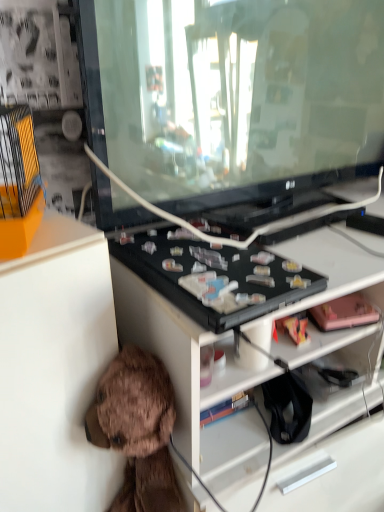
In order to face pink matte toy at right, which is the first toy in top-to-bottom order, should I rotate leftwards or rightwards?

Rotate your view right by about 19.584°.

Where is `pink matte toy at right, which is the first toy in top-to-bottom order`? The image size is (384, 512). pink matte toy at right, which is the first toy in top-to-bottom order is located at coordinates (344, 313).

Where is `pink matte toy at right, placed as the 2th toy when sorted from left to right`? This screenshot has width=384, height=512. pink matte toy at right, placed as the 2th toy when sorted from left to right is located at coordinates (344, 313).

How far apart are brown plush toy at lower left, the 2th toy positioned from the right, and transparent glass tv at center?

A: brown plush toy at lower left, the 2th toy positioned from the right, and transparent glass tv at center are 21.65 inches apart from each other.

Considering the relative sizes of brown plush toy at lower left, marked as the first toy in a bottom-to-top arrangement, and transparent glass tv at center in the image provided, is brown plush toy at lower left, marked as the first toy in a bottom-to-top arrangement, taller than transparent glass tv at center?

Yes, brown plush toy at lower left, marked as the first toy in a bottom-to-top arrangement, is taller than transparent glass tv at center.

In the scene shown: Does brown plush toy at lower left, the 2th toy positioned from the right, appear on the left side of transparent glass tv at center?

Yes.

Is brown plush toy at lower left, which is the 1th toy in left-to-right order, next to transparent glass tv at center?

No, brown plush toy at lower left, which is the 1th toy in left-to-right order, is not in contact with transparent glass tv at center.

Is pink matte toy at right, which is the first toy in top-to-bottom order, wider or thinner than brown plush toy at lower left, the 2th toy positioned from the right?

Clearly, pink matte toy at right, which is the first toy in top-to-bottom order, has less width compared to brown plush toy at lower left, the 2th toy positioned from the right.

Which of these two, pink matte toy at right, which is the second toy in bottom-to-top order, or brown plush toy at lower left, the 2th toy positioned from the right, stands shorter?

Standing shorter between the two is pink matte toy at right, which is the second toy in bottom-to-top order.

Visually, is pink matte toy at right, which is the second toy in bottom-to-top order, positioned to the left or to the right of brown plush toy at lower left, which is the 1th toy in left-to-right order?

pink matte toy at right, which is the second toy in bottom-to-top order, is to the right of brown plush toy at lower left, which is the 1th toy in left-to-right order.

I want to click on toy above the brown plush toy at lower left, marked as the first toy in a bottom-to-top arrangement (from the image's perspective), so click(x=344, y=313).

Between transparent glass tv at center and pink matte toy at right, the first toy when ordered from right to left, which one is positioned behind?

pink matte toy at right, the first toy when ordered from right to left, is further away from the camera.

In terms of height, does transparent glass tv at center look taller or shorter compared to pink matte toy at right, which is the first toy in top-to-bottom order?

In the image, transparent glass tv at center appears to be taller than pink matte toy at right, which is the first toy in top-to-bottom order.

Locate an element on the screen. the 1st toy below the transparent glass tv at center (from the image's perspective) is located at coordinates (344, 313).

Is transparent glass tv at center bigger than pink matte toy at right, placed as the 2th toy when sorted from left to right?

Yes.

Is brown plush toy at lower left, positioned as the 2th toy in top-to-bottom order, aimed at white matte cabinet at lower left?

No, brown plush toy at lower left, positioned as the 2th toy in top-to-bottom order, is not turned towards white matte cabinet at lower left.

Can you confirm if brown plush toy at lower left, the 2th toy positioned from the right, is wider than white matte cabinet at lower left?

No, brown plush toy at lower left, the 2th toy positioned from the right, is not wider than white matte cabinet at lower left.

Based on the photo, is brown plush toy at lower left, which is the 1th toy in left-to-right order, positioned far away from white matte cabinet at lower left?

They are positioned close to each other.

From the image's perspective, would you say brown plush toy at lower left, marked as the first toy in a bottom-to-top arrangement, is positioned over white matte cabinet at lower left?

Actually, brown plush toy at lower left, marked as the first toy in a bottom-to-top arrangement, appears below white matte cabinet at lower left in the image.

Is point (235, 194) less distant than point (121, 463)?

No, (235, 194) is behind (121, 463).

Is transparent glass tv at center not close to white matte cabinet at lower left?

No, transparent glass tv at center is not far from white matte cabinet at lower left.

Is transparent glass tv at center bigger than white matte cabinet at lower left?

Correct, transparent glass tv at center is larger in size than white matte cabinet at lower left.

Which object is thinner, transparent glass tv at center or white matte cabinet at lower left?

With smaller width is transparent glass tv at center.

How much distance is there between white matte cabinet at lower left and transparent glass tv at center?

white matte cabinet at lower left is 17.20 inches from transparent glass tv at center.

Which point is more distant from viewer, (95, 328) or (383, 38)?

Point (383, 38)

How many degrees apart are the facing directions of white matte cabinet at lower left and transparent glass tv at center?

9.65 degrees.

Relative to transparent glass tv at center, is white matte cabinet at lower left in front or behind?

white matte cabinet at lower left is in front of transparent glass tv at center.

Considering the relative sizes of transparent glass tv at center and brown plush toy at lower left, the 2th toy positioned from the right, in the image provided, is transparent glass tv at center bigger than brown plush toy at lower left, the 2th toy positioned from the right,?

Yes.

Is transparent glass tv at center taller than brown plush toy at lower left, the 2th toy positioned from the right?

In fact, transparent glass tv at center may be shorter than brown plush toy at lower left, the 2th toy positioned from the right.

From a real-world perspective, is transparent glass tv at center physically above brown plush toy at lower left, marked as the first toy in a bottom-to-top arrangement?

Yes, from a real-world perspective, transparent glass tv at center is on top of brown plush toy at lower left, marked as the first toy in a bottom-to-top arrangement.

Can brown plush toy at lower left, the 2th toy positioned from the right, be found inside transparent glass tv at center?

No, brown plush toy at lower left, the 2th toy positioned from the right, is not a part of transparent glass tv at center.

Find the location of `the 1st toy behind the transparent glass tv at center, starting your count from the anchor`. the 1st toy behind the transparent glass tv at center, starting your count from the anchor is located at coordinates (137, 429).

Image resolution: width=384 pixels, height=512 pixels. I want to click on toy that is on the right side of brown plush toy at lower left, marked as the first toy in a bottom-to-top arrangement, so [x=344, y=313].

Estimate the real-world distances between objects in this image. Which object is further from transparent glass tv at center, pink matte toy at right, which is the first toy in top-to-bottom order, or white matte cabinet at lower left?

pink matte toy at right, which is the first toy in top-to-bottom order.

Estimate the real-world distances between objects in this image. Which object is closer to brown plush toy at lower left, positioned as the 2th toy in top-to-bottom order, white matte cabinet at lower left or transparent glass tv at center?

white matte cabinet at lower left lies closer to brown plush toy at lower left, positioned as the 2th toy in top-to-bottom order, than the other object.

When comparing their distances from brown plush toy at lower left, positioned as the 2th toy in top-to-bottom order, does pink matte toy at right, the first toy when ordered from right to left, or white matte cabinet at lower left seem further?

Among the two, pink matte toy at right, the first toy when ordered from right to left, is located further to brown plush toy at lower left, positioned as the 2th toy in top-to-bottom order.

Based on their spatial positions, is brown plush toy at lower left, the 2th toy positioned from the right, or pink matte toy at right, which is the first toy in top-to-bottom order, closer to white matte cabinet at lower left?

brown plush toy at lower left, the 2th toy positioned from the right, is positioned closer to the anchor white matte cabinet at lower left.

Based on their spatial positions, is transparent glass tv at center or white matte cabinet at lower left closer to brown plush toy at lower left, the 2th toy positioned from the right?

white matte cabinet at lower left lies closer to brown plush toy at lower left, the 2th toy positioned from the right, than the other object.

In the scene shown: Based on their spatial positions, is pink matte toy at right, which is the first toy in top-to-bottom order, or transparent glass tv at center closer to brown plush toy at lower left, the 2th toy positioned from the right?

pink matte toy at right, which is the first toy in top-to-bottom order.

Looking at the image, which one is located closer to pink matte toy at right, which is the second toy in bottom-to-top order, white matte cabinet at lower left or brown plush toy at lower left, which is the 1th toy in left-to-right order?

brown plush toy at lower left, which is the 1th toy in left-to-right order, is closer to pink matte toy at right, which is the second toy in bottom-to-top order.

Based on their spatial positions, is white matte cabinet at lower left or brown plush toy at lower left, positioned as the 2th toy in top-to-bottom order, closer to transparent glass tv at center?

white matte cabinet at lower left.

Image resolution: width=384 pixels, height=512 pixels. Find the location of `toy between transparent glass tv at center and brown plush toy at lower left, positioned as the 2th toy in top-to-bottom order, in the vertical direction`. toy between transparent glass tv at center and brown plush toy at lower left, positioned as the 2th toy in top-to-bottom order, in the vertical direction is located at coordinates (344, 313).

Where is `cabinetry that lies between transparent glass tv at center and brown plush toy at lower left, marked as the first toy in a bottom-to-top arrangement, from top to bottom`? Image resolution: width=384 pixels, height=512 pixels. cabinetry that lies between transparent glass tv at center and brown plush toy at lower left, marked as the first toy in a bottom-to-top arrangement, from top to bottom is located at coordinates pos(55,369).

This screenshot has height=512, width=384. I want to click on television between white matte cabinet at lower left and pink matte toy at right, which is the second toy in bottom-to-top order, in the horizontal direction, so click(x=232, y=96).

Where is `toy between white matte cabinet at lower left and pink matte toy at right, placed as the 2th toy when sorted from left to right, from left to right`? The height and width of the screenshot is (512, 384). toy between white matte cabinet at lower left and pink matte toy at right, placed as the 2th toy when sorted from left to right, from left to right is located at coordinates (137, 429).